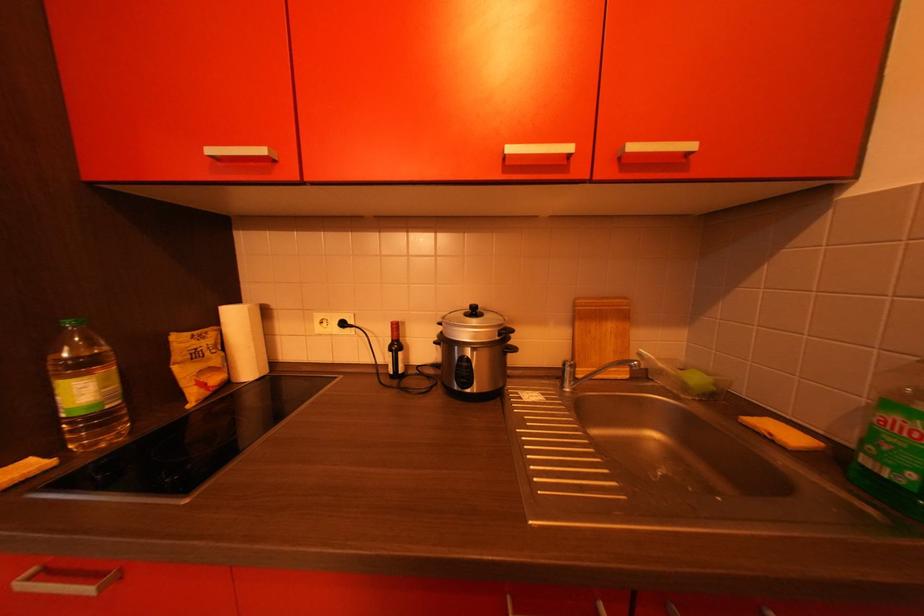
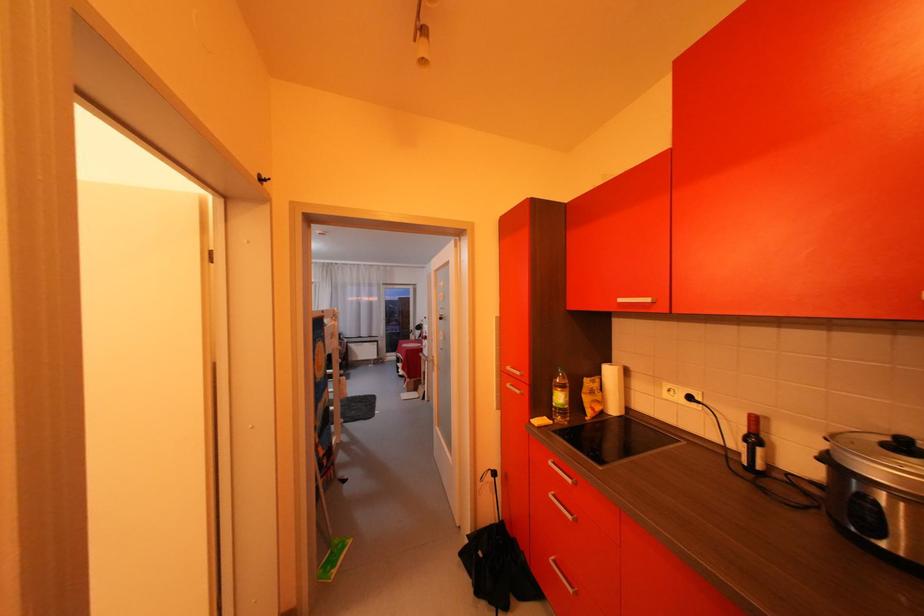
Locate, in the second image, the point that corresponds to (x=485, y=314) in the first image.

(917, 448)